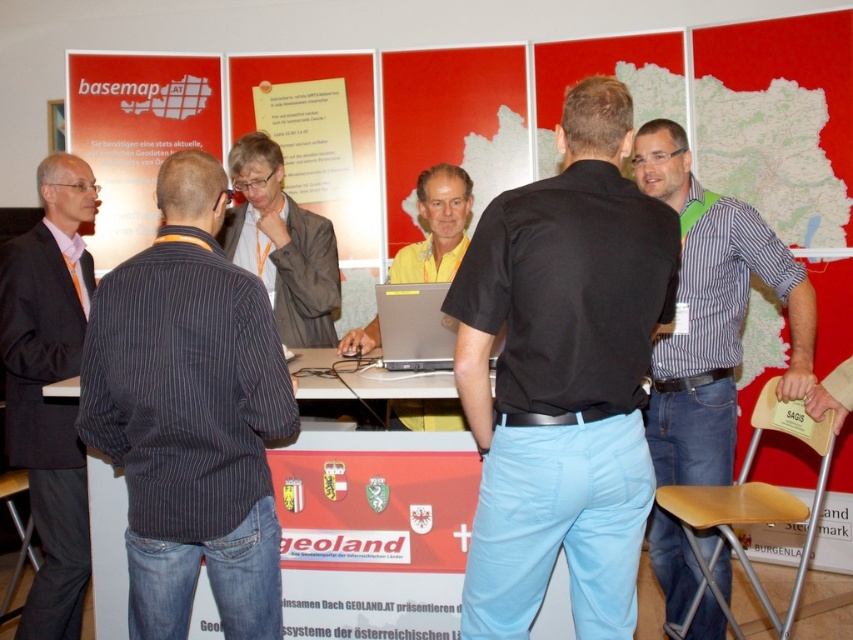
You are organizing a small presentation and need to place a name tag on the table. The name tag is 10 cm wide. There is a matte map at center and a wooden stool at lower right. Can you fit the name tag between them?

The matte map at center is positioned on the left side of wooden stool at lower right, so there is space between them. The name tag of 10 cm width can be placed in the gap between the matte map at center and the wooden stool at lower right.